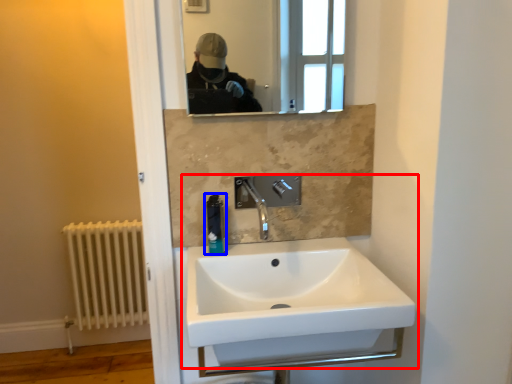
Question: Which of the following is the farthest to the observer, sink (highlighted by a red box) or soap dispenser (highlighted by a blue box)?

Choices:
 (A) sink
 (B) soap dispenser

Answer: (B)